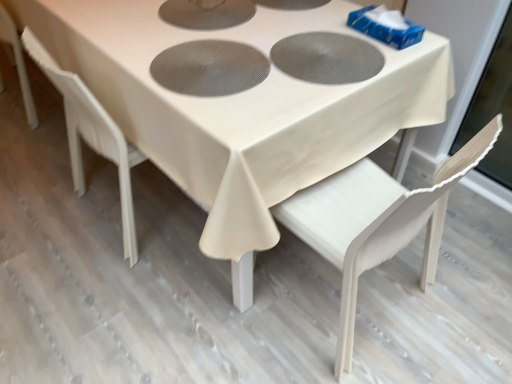
Locate an element on the screen. Image resolution: width=512 pixels, height=384 pixels. free space between white fabric table at center and white plastic chair at lower left, acting as the first chair starting from the left is located at coordinates (70, 184).